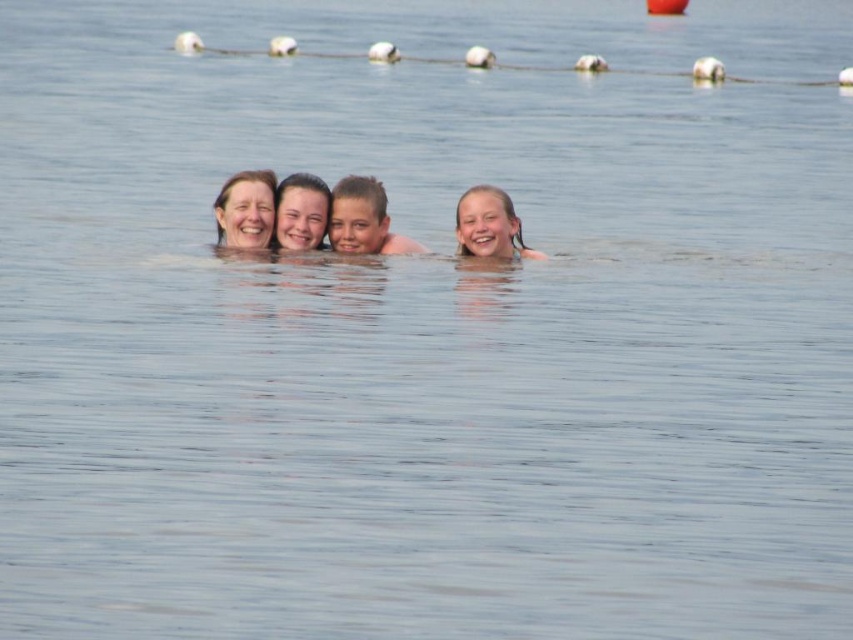
Is smooth skin boy at center shorter than smooth skin girl at upper center?

Incorrect, smooth skin boy at center's height does not fall short of smooth skin girl at upper center's.

The image size is (853, 640). Find the location of `smooth skin boy at center`. smooth skin boy at center is located at coordinates (364, 220).

This screenshot has height=640, width=853. I want to click on smooth skin boy at center, so click(364, 220).

Can you confirm if matte skin at upper center is bigger than matte skin face at center?

Indeed, matte skin at upper center has a larger size compared to matte skin face at center.

Who is lower down, matte skin at upper center or matte skin face at center?

matte skin face at center is lower down.

Describe the element at coordinates (245, 209) in the screenshot. Image resolution: width=853 pixels, height=640 pixels. I see `matte skin at upper center` at that location.

Where is `matte skin at upper center`? The height and width of the screenshot is (640, 853). matte skin at upper center is located at coordinates (245, 209).

Can you confirm if smooth skin girl at upper center is positioned to the left of matte skin at upper center?

No, smooth skin girl at upper center is not to the left of matte skin at upper center.

Between smooth skin girl at upper center and matte skin at upper center, which one has more height?

matte skin at upper center

Where is `smooth skin girl at upper center`? smooth skin girl at upper center is located at coordinates (489, 225).